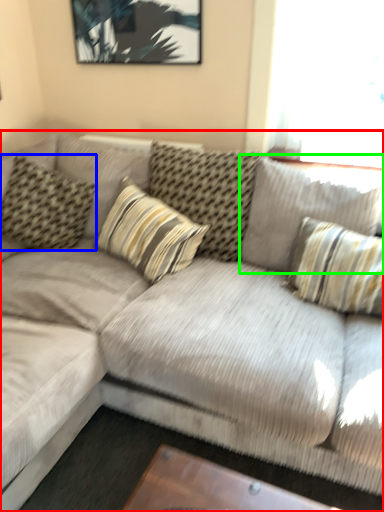
Question: Which object is positioned closest to studio couch (highlighted by a red box)? Select from pillow (highlighted by a blue box) and pillow (highlighted by a green box).

Choices:
 (A) pillow
 (B) pillow

Answer: (B)